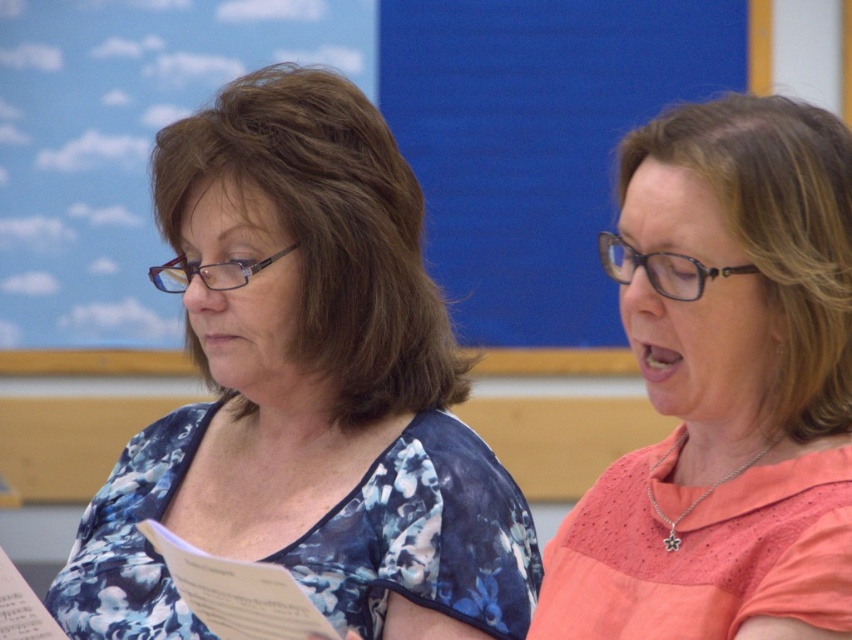
Question: Which of the following is the closest to the observer?

Choices:
 (A) (306, 170)
 (B) (758, 259)

Answer: (B)

Question: Is blue floral blouse at center thinner than pink fabric shirt at upper right?

Choices:
 (A) yes
 (B) no

Answer: (B)

Question: Estimate the real-world distances between objects in this image. Which object is farther from the pink fabric shirt at upper right?

Choices:
 (A) blue matte bulletin board at upper center
 (B) blue floral blouse at center

Answer: (A)

Question: Does blue floral blouse at center appear over pink fabric shirt at upper right?

Choices:
 (A) yes
 (B) no

Answer: (A)

Question: Can you confirm if blue floral blouse at center is wider than blue matte bulletin board at upper center?

Choices:
 (A) no
 (B) yes

Answer: (B)

Question: Which object appears closest to the camera in this image?

Choices:
 (A) pink fabric shirt at upper right
 (B) blue floral blouse at center

Answer: (A)